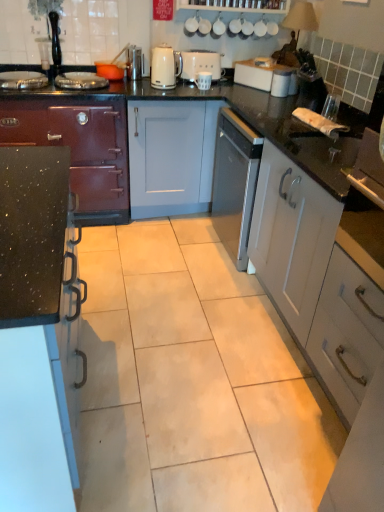
Locate an element on the screen. metallic silver toaster at upper center, which ranks as the 3th appliance in right-to-left order is located at coordinates (135, 62).

The width and height of the screenshot is (384, 512). What are the coordinates of `white matte cabinet at right, which is counted as the 3th cabinetry, starting from the left` in the screenshot? It's located at (320, 275).

This screenshot has width=384, height=512. What do you see at coordinates (165, 67) in the screenshot? I see `white glossy kettle at upper center` at bounding box center [165, 67].

Where is `white plastic toaster at upper center`? Image resolution: width=384 pixels, height=512 pixels. white plastic toaster at upper center is located at coordinates (266, 76).

I want to click on metallic silver toaster at upper center, which is counted as the 1th appliance, starting from the left, so click(x=135, y=62).

Which is in front, white plastic toaster at upper center or white glossy kettle at upper center?

white glossy kettle at upper center is closer to the camera.

Considering the positions of points (240, 73) and (174, 64), is point (240, 73) farther from camera compared to point (174, 64)?

That is True.

Considering the relative positions of white plastic toaster at upper center and white glossy kettle at upper center in the image provided, is white plastic toaster at upper center to the right of white glossy kettle at upper center from the viewer's perspective?

Correct, you'll find white plastic toaster at upper center to the right of white glossy kettle at upper center.

This screenshot has width=384, height=512. Find the location of `toaster lying behind the white glossy kettle at upper center`. toaster lying behind the white glossy kettle at upper center is located at coordinates (266, 76).

From a real-world perspective, is white glossy kettle at upper center located beneath black speckled countertop at left, the 2th cabinetry viewed from the left?

No.

Can you confirm if white glossy kettle at upper center is smaller than black speckled countertop at left, positioned as the second cabinetry in right-to-left order?

Indeed, white glossy kettle at upper center has a smaller size compared to black speckled countertop at left, positioned as the second cabinetry in right-to-left order.

Is white glossy kettle at upper center to the right of black speckled countertop at left, the 2th cabinetry viewed from the left, from the viewer's perspective?

Yes.

How distant is white matte toaster at center, arranged as the 2th appliance when viewed from the right, from white matte cabinet at right, which is the 1th cabinetry in right-to-left order?

A distance of 1.67 meters exists between white matte toaster at center, arranged as the 2th appliance when viewed from the right, and white matte cabinet at right, which is the 1th cabinetry in right-to-left order.

From the image's perspective, is white matte toaster at center, which is counted as the second appliance, starting from the left, above white matte cabinet at right, which is counted as the 3th cabinetry, starting from the left?

Yes, from the image's perspective, white matte toaster at center, which is counted as the second appliance, starting from the left, is on top of white matte cabinet at right, which is counted as the 3th cabinetry, starting from the left.

From the white matte cabinet at right, which is the 1th cabinetry in right-to-left order, count the 2nd appliance to the left and point to it. Please provide its 2D coordinates.

[(200, 64)]

Is white matte toaster at center, which is counted as the second appliance, starting from the left, aimed at white matte cabinet at right, which is counted as the 3th cabinetry, starting from the left?

Yes, white matte toaster at center, which is counted as the second appliance, starting from the left, is aimed at white matte cabinet at right, which is counted as the 3th cabinetry, starting from the left.

From the image's perspective, does white glossy kettle at upper center appear lower than metallic silver toaster at upper center, which is counted as the 1th appliance, starting from the left?

Correct, white glossy kettle at upper center appears lower than metallic silver toaster at upper center, which is counted as the 1th appliance, starting from the left, in the image.

Is white glossy kettle at upper center far from metallic silver toaster at upper center, which is counted as the 1th appliance, starting from the left?

No, white glossy kettle at upper center is not far from metallic silver toaster at upper center, which is counted as the 1th appliance, starting from the left.

Considering the sizes of objects white glossy kettle at upper center and metallic silver toaster at upper center, which is counted as the 1th appliance, starting from the left, in the image provided, who is thinner, white glossy kettle at upper center or metallic silver toaster at upper center, which is counted as the 1th appliance, starting from the left,?

With smaller width is metallic silver toaster at upper center, which is counted as the 1th appliance, starting from the left.

Is white glossy kettle at upper center positioned beyond the bounds of metallic silver toaster at upper center, which ranks as the 3th appliance in right-to-left order?

Yes, white glossy kettle at upper center is located beyond the bounds of metallic silver toaster at upper center, which ranks as the 3th appliance in right-to-left order.

Which object is more forward, white matte toaster at center, which is counted as the second appliance, starting from the left, or metallic silver toaster at upper center, which ranks as the 3th appliance in right-to-left order?

Positioned in front is metallic silver toaster at upper center, which ranks as the 3th appliance in right-to-left order.

From a real-world perspective, between white matte toaster at center, arranged as the 2th appliance when viewed from the right, and metallic silver toaster at upper center, which is counted as the 1th appliance, starting from the left, who is vertically lower?

white matte toaster at center, arranged as the 2th appliance when viewed from the right.

Between white matte toaster at center, arranged as the 2th appliance when viewed from the right, and metallic silver toaster at upper center, which is counted as the 1th appliance, starting from the left, which one has smaller size?

Smaller between the two is metallic silver toaster at upper center, which is counted as the 1th appliance, starting from the left.

Can you tell me how much white matte toaster at center, which is counted as the second appliance, starting from the left, and metallic silver toaster at upper center, which is counted as the 1th appliance, starting from the left, differ in facing direction?

They differ by 1.13 degrees in their facing directions.

Does white plastic toaster at upper center have a lesser height compared to white matte cabinet at right, which is the 1th cabinetry in right-to-left order?

Yes.

Is point (286, 75) positioned before point (315, 371)?

No, it is behind (315, 371).

Considering the relative positions of white plastic toaster at upper center and white matte cabinet at right, which is the 1th cabinetry in right-to-left order, in the image provided, is white plastic toaster at upper center behind white matte cabinet at right, which is the 1th cabinetry in right-to-left order,?

Yes, it is.

What's the angular difference between white plastic toaster at upper center and white matte cabinet at right, which is the 1th cabinetry in right-to-left order,'s facing directions?

They differ by 31.1 degrees in their facing directions.

Considering the sizes of objects white glossy kettle at upper center and white matte toaster at center, arranged as the 2th appliance when viewed from the right, in the image provided, who is wider, white glossy kettle at upper center or white matte toaster at center, arranged as the 2th appliance when viewed from the right,?

With larger width is white matte toaster at center, arranged as the 2th appliance when viewed from the right.

Is white glossy kettle at upper center positioned with its back to white matte toaster at center, which is counted as the second appliance, starting from the left?

white glossy kettle at upper center is not turned away from white matte toaster at center, which is counted as the second appliance, starting from the left.

Is white glossy kettle at upper center at the left side of white matte toaster at center, arranged as the 2th appliance when viewed from the right?

Correct, you'll find white glossy kettle at upper center to the left of white matte toaster at center, arranged as the 2th appliance when viewed from the right.

From the image's perspective, does white glossy kettle at upper center appear lower than white matte toaster at center, arranged as the 2th appliance when viewed from the right?

Indeed, from the image's perspective, white glossy kettle at upper center is shown beneath white matte toaster at center, arranged as the 2th appliance when viewed from the right.

The height and width of the screenshot is (512, 384). What are the coordinates of `toaster that appears above the white glossy kettle at upper center (from the image's perspective)` in the screenshot? It's located at (266, 76).

Find the location of a particular element. The height and width of the screenshot is (512, 384). kitchen appliance that is above the black speckled countertop at left, the 2th cabinetry viewed from the left (from a real-world perspective) is located at coordinates (165, 67).

Considering their positions, is white plastic toaster at upper center positioned closer to white glossy kettle at upper center than white matte cabinet at right, which is the 1th cabinetry in right-to-left order?

white plastic toaster at upper center lies closer to white glossy kettle at upper center than the other object.

Considering their positions, is matte black stove at left, which is counted as the first cabinetry, starting from the left, positioned further to white matte cabinet at right, which is counted as the 3th cabinetry, starting from the left, than white plastic toaster at upper center?

matte black stove at left, which is counted as the first cabinetry, starting from the left.

Consider the image. When comparing their distances from white matte toaster at center, arranged as the 2th appliance when viewed from the right, does matte black stove at left, which is counted as the first cabinetry, starting from the left, or white glossy kettle at upper center seem further?

matte black stove at left, which is counted as the first cabinetry, starting from the left.

Which object lies nearer to the anchor point white matte mug at center, which is counted as the 1th appliance, starting from the right, metallic silver toaster at upper center, which is counted as the 1th appliance, starting from the left, or white matte toaster at center, arranged as the 2th appliance when viewed from the right?

white matte toaster at center, arranged as the 2th appliance when viewed from the right, is positioned closer to the anchor white matte mug at center, which is counted as the 1th appliance, starting from the right.

When comparing their distances from white plastic toaster at upper center, does white matte mug at center, positioned as the 3th appliance in left-to-right order, or white matte cabinet at right, which is counted as the 3th cabinetry, starting from the left, seem closer?

white matte mug at center, positioned as the 3th appliance in left-to-right order.

Based on their spatial positions, is black speckled countertop at left, the 2th cabinetry viewed from the left, or metallic silver toaster at upper center, which is counted as the 1th appliance, starting from the left, further from white matte toaster at center, which is counted as the second appliance, starting from the left?

black speckled countertop at left, the 2th cabinetry viewed from the left.

Looking at the image, which one is located further to metallic silver toaster at upper center, which is counted as the 1th appliance, starting from the left, black speckled countertop at left, the 2th cabinetry viewed from the left, or matte black stove at left, the third cabinetry when ordered from right to left?

black speckled countertop at left, the 2th cabinetry viewed from the left, is positioned further to the anchor metallic silver toaster at upper center, which is counted as the 1th appliance, starting from the left.

Based on their spatial positions, is black speckled countertop at left, the 2th cabinetry viewed from the left, or matte black stove at left, the third cabinetry when ordered from right to left, closer to white matte cabinet at right, which is the 1th cabinetry in right-to-left order?

black speckled countertop at left, the 2th cabinetry viewed from the left.

Locate an element on the screen. The width and height of the screenshot is (384, 512). appliance located between white glossy kettle at upper center and white matte mug at center, which is counted as the 1th appliance, starting from the right, in the left-right direction is located at coordinates (200, 64).

Image resolution: width=384 pixels, height=512 pixels. I want to click on kitchen appliance between white matte cabinet at right, which is the 1th cabinetry in right-to-left order, and white matte toaster at center, which is counted as the second appliance, starting from the left, along the z-axis, so click(x=165, y=67).

At what (x,y) coordinates should I click in order to perform the action: click on appliance located between matte black stove at left, which is counted as the first cabinetry, starting from the left, and white glossy kettle at upper center in the left-right direction. Please return your answer as a coordinate pair (x, y). This screenshot has width=384, height=512. Looking at the image, I should click on (135, 62).

The width and height of the screenshot is (384, 512). In order to click on appliance located between white matte toaster at center, which is counted as the second appliance, starting from the left, and white plastic toaster at upper center in the left-right direction in this screenshot , I will do `click(203, 80)`.